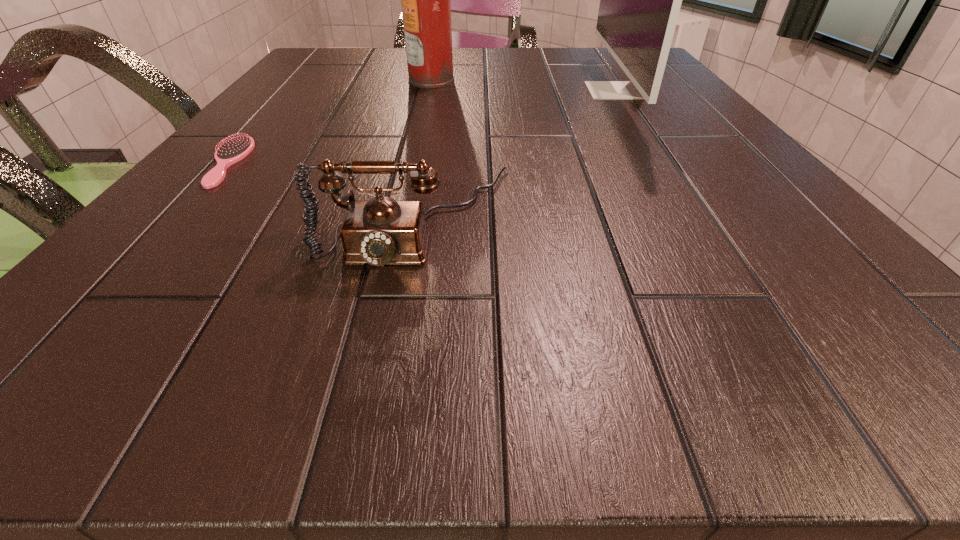
Image resolution: width=960 pixels, height=540 pixels. What are the coordinates of `blank region between the shortest object and the fire extinguisher` in the screenshot? It's located at (328, 121).

Image resolution: width=960 pixels, height=540 pixels. What are the coordinates of `free point between the rightmost object and the leftmost object` in the screenshot? It's located at (420, 126).

Where is `vacant space in between the fire extinguisher and the second shortest object`? The height and width of the screenshot is (540, 960). vacant space in between the fire extinguisher and the second shortest object is located at coordinates (423, 148).

You are a GUI agent. You are given a task and a screenshot of the screen. Output one action in this format:
    pyautogui.click(x=<x>, y=<y>)
    Task: Click on the vacant space in between the fire extinguisher and the shortest object
    The height and width of the screenshot is (540, 960).
    Given the screenshot: What is the action you would take?
    pyautogui.click(x=328, y=121)

Locate an element on the screen. The height and width of the screenshot is (540, 960). vacant region between the fire extinguisher and the second shortest object is located at coordinates (423, 148).

Locate an element on the screen. This screenshot has width=960, height=540. vacant space that's between the telephone and the rightmost object is located at coordinates (515, 153).

Locate an element on the screen. blank region between the monitor and the shortest object is located at coordinates (420, 126).

This screenshot has width=960, height=540. I want to click on free space between the hairbrush and the monitor, so click(420, 126).

Where is `the second closest object to the second tallest object`? Image resolution: width=960 pixels, height=540 pixels. the second closest object to the second tallest object is located at coordinates (426, 0).

Select which object is the third closest to the fire extinguisher. Please provide its 2D coordinates. Your answer should be formatted as a tuple, i.e. [(x, y)], where the tuple contains the x and y coordinates of a point satisfying the conditions above.

[(382, 231)]